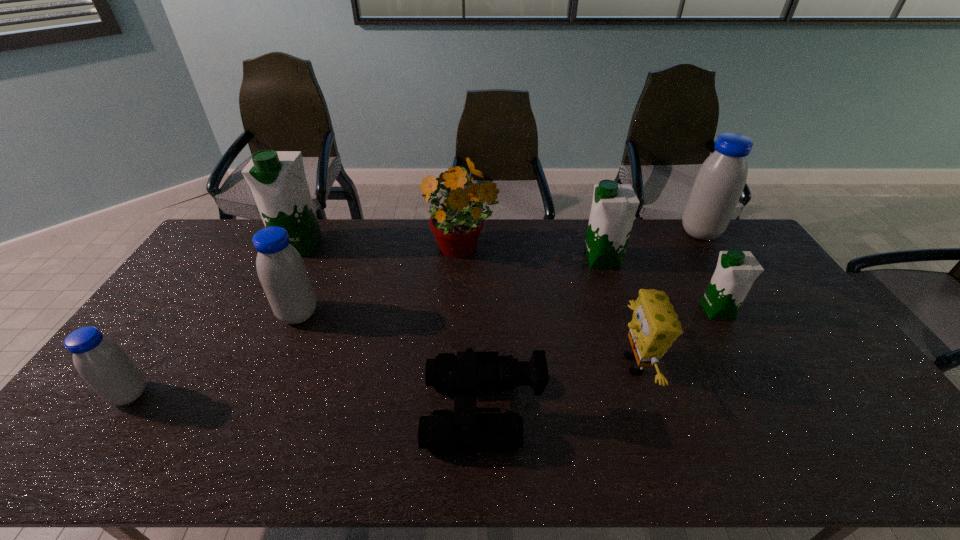
Locate which soya milk is the fifth closest to the biggest blue soya milk. Please provide its 2D coordinates. Your answer should be formatted as a tuple, i.e. [(x, y)], where the tuple contains the x and y coordinates of a point satisfying the conditions above.

[(103, 364)]

Locate which soya milk is the second closest to the sponge. Please provide its 2D coordinates. Your answer should be formatted as a tuple, i.e. [(x, y)], where the tuple contains the x and y coordinates of a point satisfying the conditions above.

[(614, 206)]

Select which blue soya milk appears as the closest to the nearest blue soya milk. Please provide its 2D coordinates. Your answer should be formatted as a tuple, i.e. [(x, y)], where the tuple contains the x and y coordinates of a point satisfying the conditions above.

[(281, 270)]

You are a GUI agent. You are given a task and a screenshot of the screen. Output one action in this format:
    pyautogui.click(x=<x>, y=<y>)
    Task: Click on the blue soya milk identified as the closest to the flowerpot
    
    Given the screenshot: What is the action you would take?
    pyautogui.click(x=281, y=270)

This screenshot has width=960, height=540. In order to click on the second closest green soya milk to the biggest blue soya milk in this screenshot , I will do `click(736, 271)`.

The image size is (960, 540). I want to click on the second closest green soya milk to the flowerpot, so [277, 179].

Image resolution: width=960 pixels, height=540 pixels. In order to click on vacant region that satisfies the following two spatial constraints: 1. on the front side of the rightmost blue soya milk; 2. on the front-facing side of the smallest green soya milk in this screenshot , I will do `click(751, 311)`.